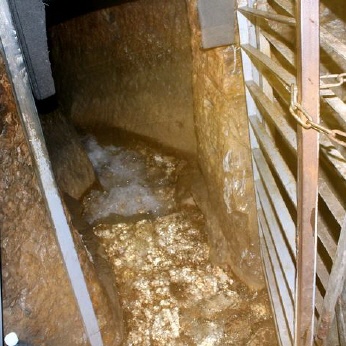
You are a GUI agent. You are given a task and a screenshot of the screen. Output one action in this format:
    pyautogui.click(x=<x>, y=<y>)
    Task: Click on the corridor
    
    Given the screenshot: What is the action you would take?
    pyautogui.click(x=123, y=73)